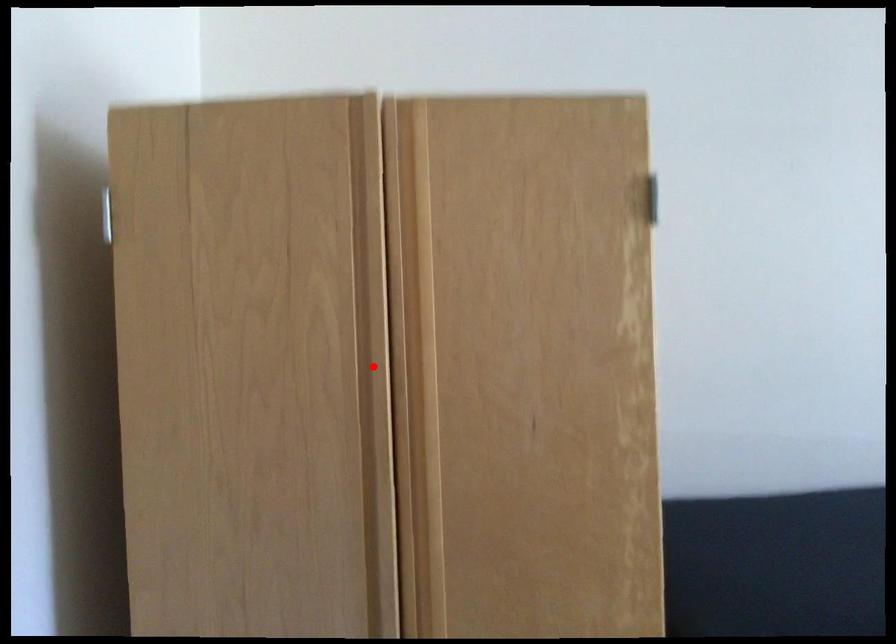
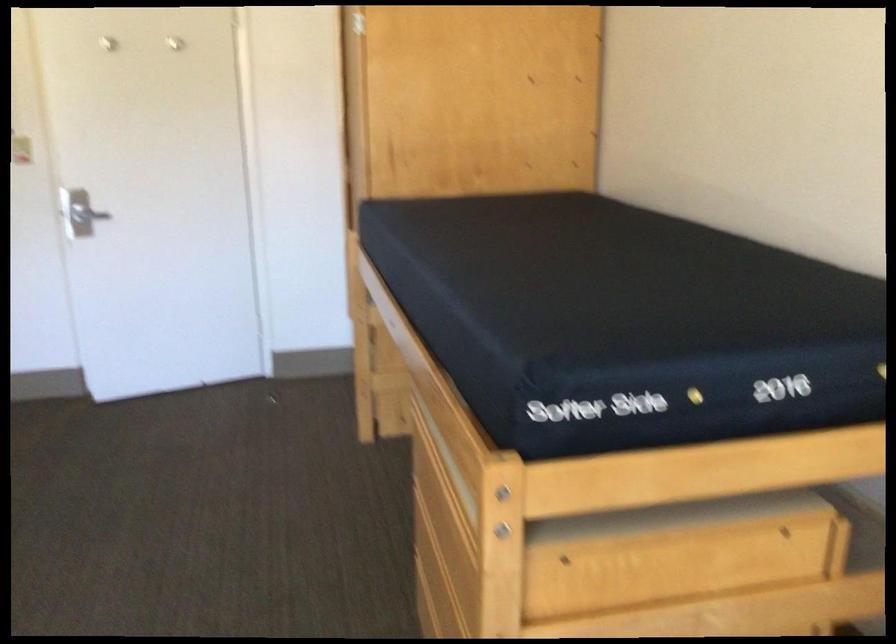
Question: I am providing you with two images of the same scene from different viewpoints. A red point is marked on the first image. Is the red point's position out of view in image 2?

Choices:
 (A) Yes
 (B) No

Answer: (A)